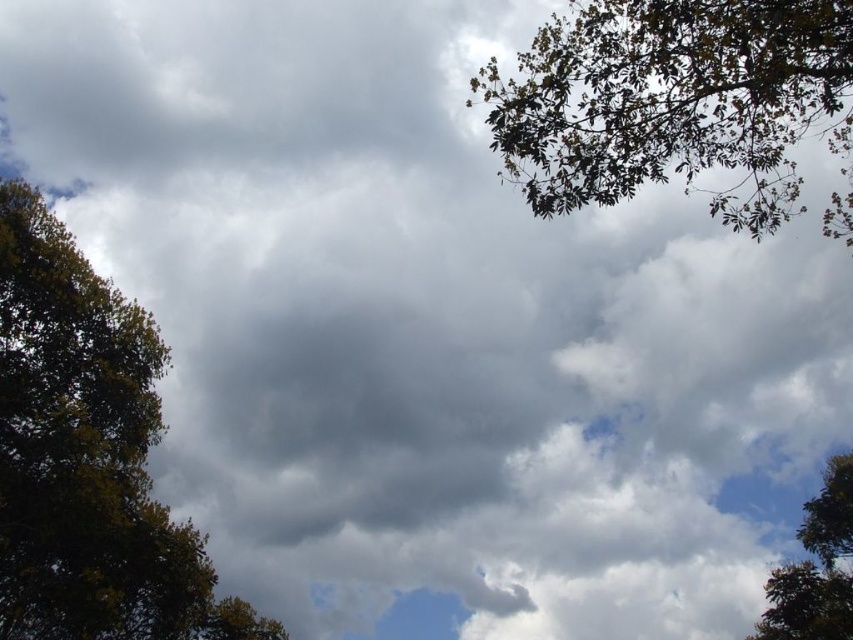
You are standing in a field looking at the sky. You see a green leafy tree at left and green leafy branches at upper right. Which object is closer to you?

The green leafy tree at left is closer to you because the green leafy branches at upper right are behind it.

You are a bird looking for a place to perch. You see the green leafy branches at upper right and the green leafy tree at lower right. Which one is taller?

The green leafy branches at upper right are taller than the green leafy tree at lower right.